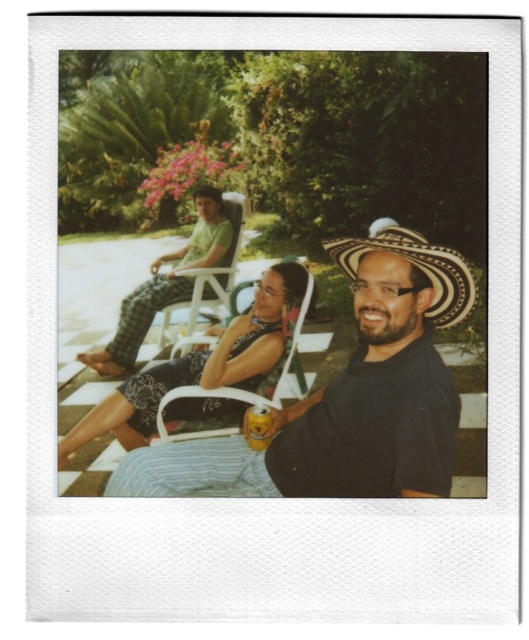
Question: Is white plastic beach chair at upper center wider than yellow matte can at center?

Choices:
 (A) no
 (B) yes

Answer: (B)

Question: Which object is the farthest from the yellow matte can at center?

Choices:
 (A) green plaid pants at upper left
 (B) black matte shirt at center
 (C) white woven straw cowboy hat at center-right
 (D) white plastic beach chair at upper center

Answer: (A)

Question: Which object is farther from the camera taking this photo?

Choices:
 (A) black matte shirt at center
 (B) white woven straw cowboy hat at center-right
 (C) white plastic beach chair at upper center

Answer: (C)

Question: Is green plaid pants at upper left positioned in front of yellow matte can at center?

Choices:
 (A) no
 (B) yes

Answer: (A)

Question: Is green plaid pants at upper left thinner than metallic white beach chair at center?

Choices:
 (A) no
 (B) yes

Answer: (A)

Question: Which of the following is the closest to the observer?

Choices:
 (A) white woven straw cowboy hat at center-right
 (B) white plastic beach chair at upper center

Answer: (A)